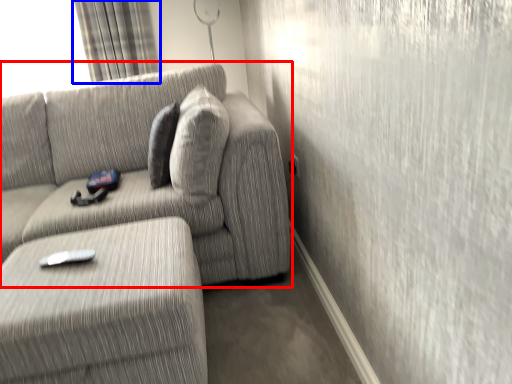
Question: Which of the following is the farthest to the observer, studio couch (highlighted by a red box) or curtain (highlighted by a blue box)?

Choices:
 (A) studio couch
 (B) curtain

Answer: (B)